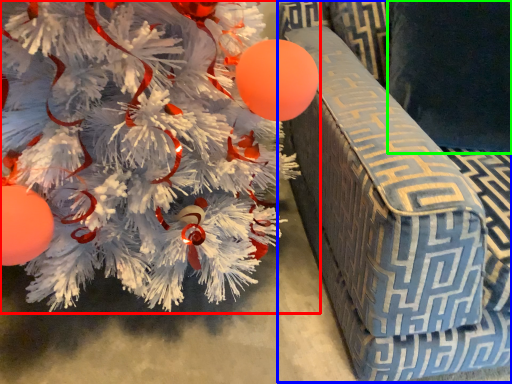
Question: Based on their relative distances, which object is nearer to christmas tree (highlighted by a red box)? Choose from armchair (highlighted by a blue box) and pillow (highlighted by a green box).

Choices:
 (A) armchair
 (B) pillow

Answer: (A)